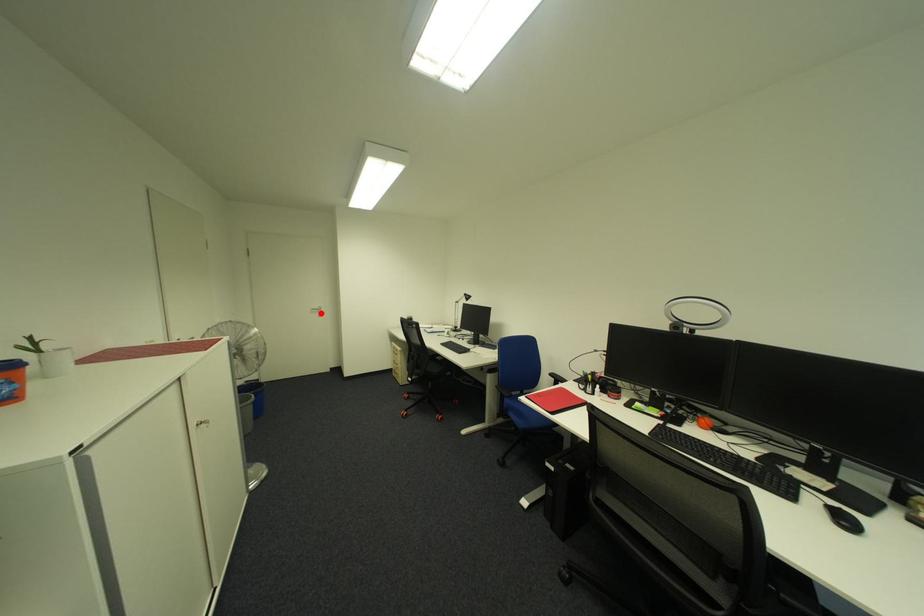
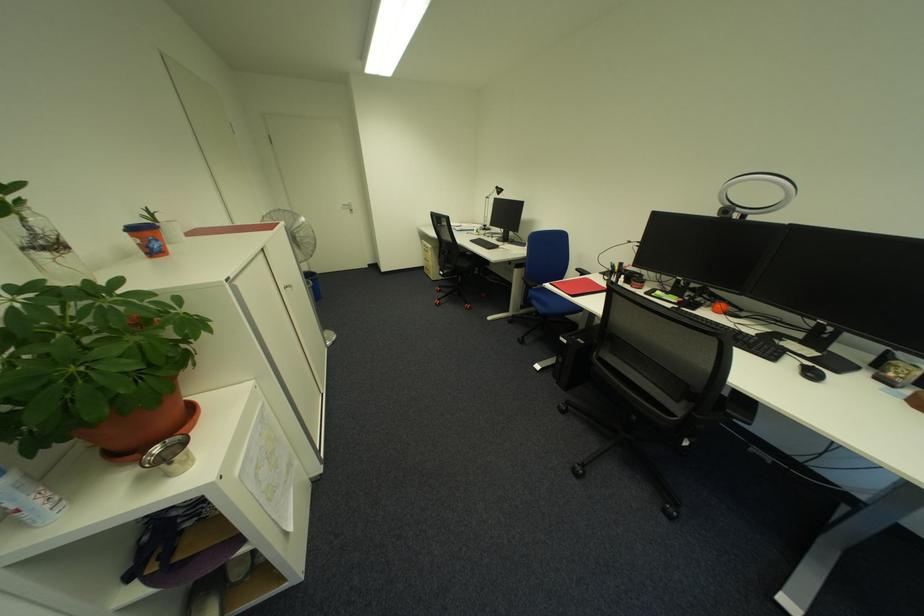
In the second image, find the point that corresponds to the highlighted location in the first image.

(353, 209)